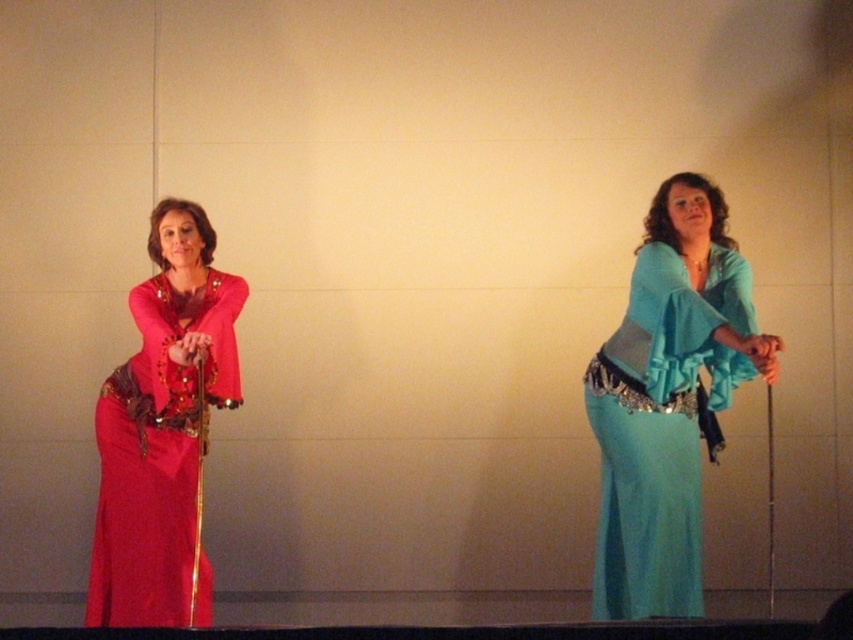
Does point (677, 500) lie in front of point (117, 516)?

Yes, point (677, 500) is in front of point (117, 516).

Is point (737, 294) positioned behind point (146, 499)?

Yes, point (737, 294) is behind point (146, 499).

Identify the location of teal satin dress at right. (668, 401).